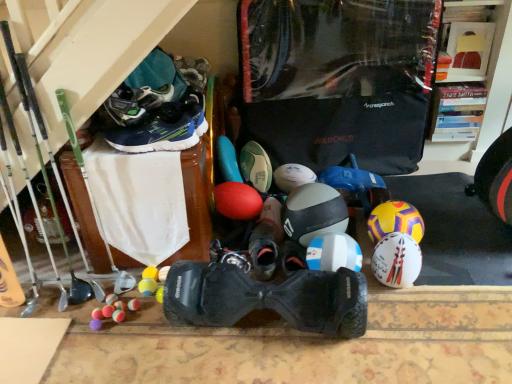
This screenshot has width=512, height=384. Identify the location of space that is in front of white matte helmet at right, which is the 4th helmet in left-to-right order. (429, 282).